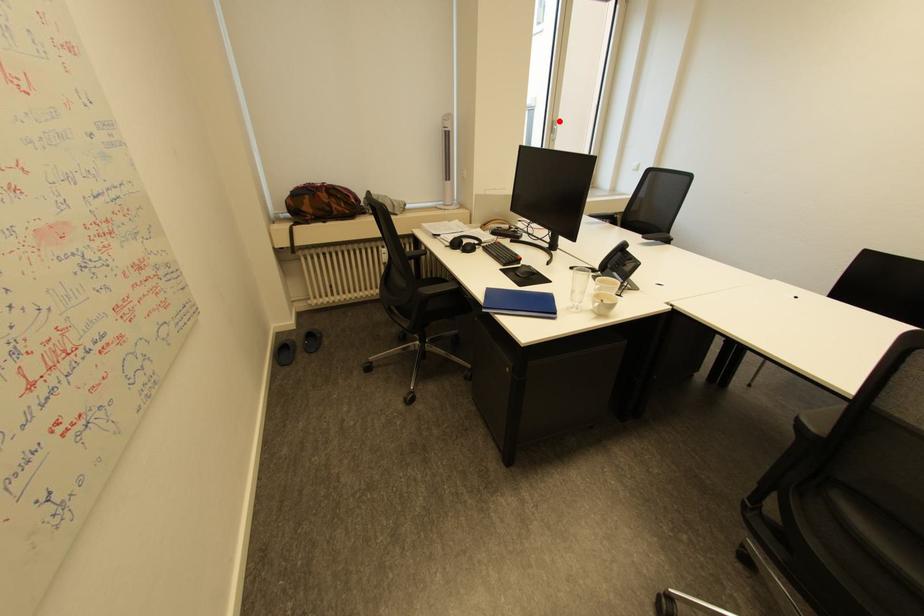
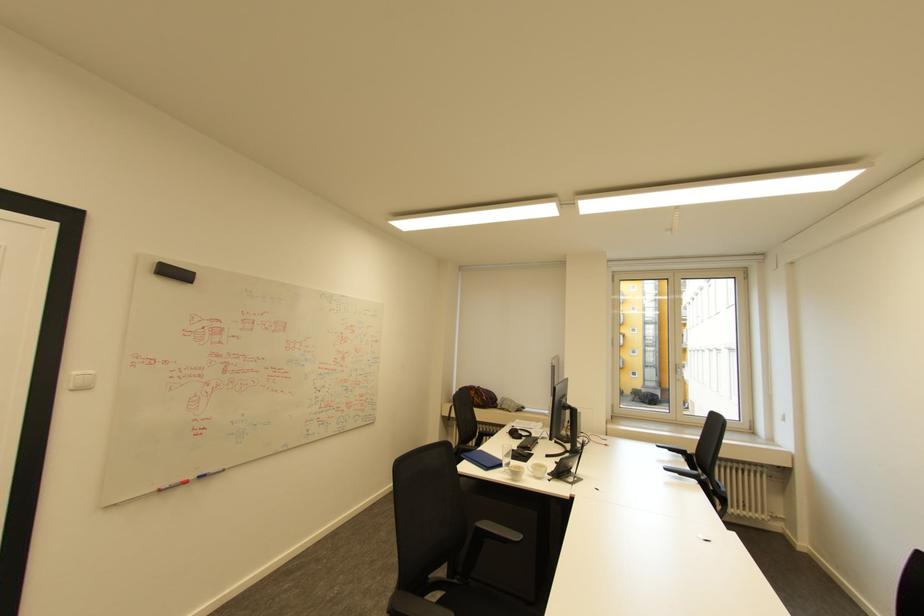
Locate, in the second image, the point that corresponds to the highlighted location in the first image.

(683, 365)